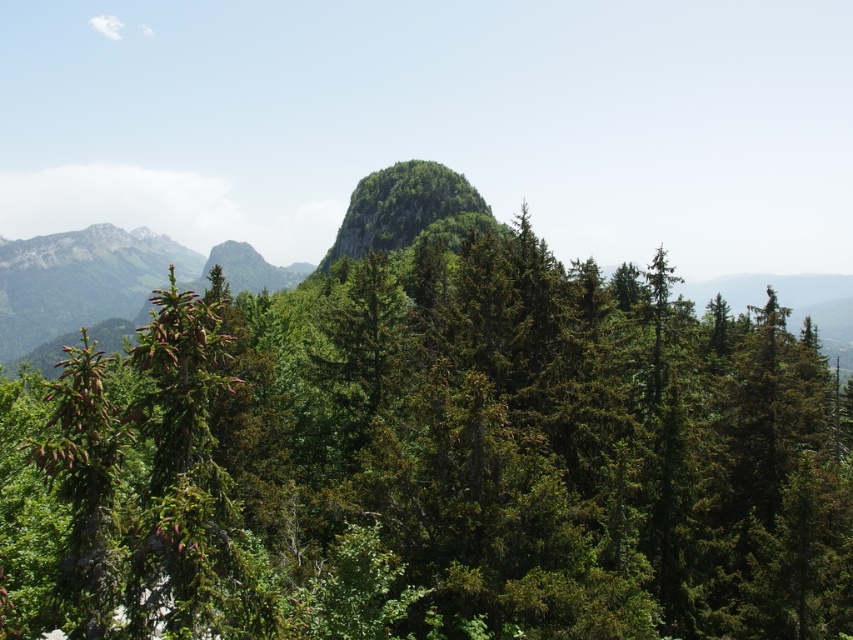
You are a hiker planning to traverse from the green matte tree at center to the green leafy peak at center. Given that your average walking speed is 3 km per hour, how long would it take you to reach the peak from the tree?

The distance between the green matte tree at center and the green leafy peak at center is 55.54 meters. Converting meters to kilometers, that is 0.05554 km. At a walking speed of 3 km per hour, the time required would be approximately 0.05554 km divided by 3 km per hour, which equals roughly 0.0185 hours. Multiplying this by 60 minutes gives about 1.11 minutes. Therefore, it would take approximately 1 minute to reach the peak from the tree.

Based on the photo, you are planning a hiking route through the forest and need to decide between two paths. One leads towards the green leafy mountain at left and the other towards the green leafy peak at center. Which path would require you to traverse a wider area of terrain?

The path leading towards the green leafy mountain at left requires traversing a wider area of terrain because its width is larger than that of the green leafy peak at center.

You are a hiker planning to take a photo of both the green leafy mountain at left and the green leafy peak at center. Since you want both in the frame, which object should you position closer to the camera to ensure they appear roughly the same size in your photo?

To make the green leafy mountain at left and the green leafy peak at center appear roughly the same size in the photo, you should position the green leafy peak at center closer to the camera because it is smaller in size compared to the green leafy mountain at left.